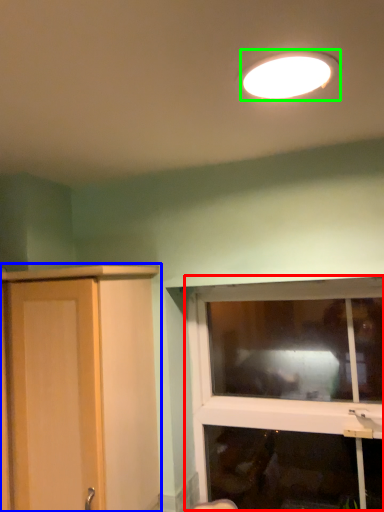
Question: Considering the real-world distances, which object is farthest from window (highlighted by a red box)? cupboard (highlighted by a blue box) or lamp (highlighted by a green box)?

Choices:
 (A) cupboard
 (B) lamp

Answer: (B)